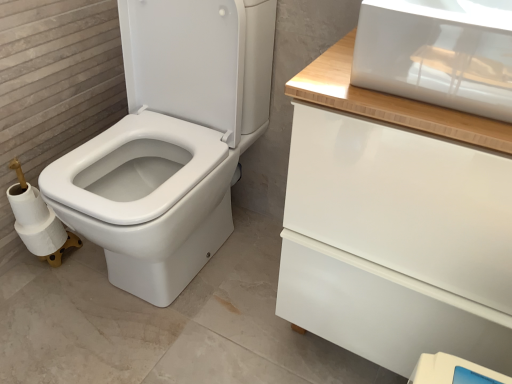
Question: Is white glossy drawer at upper right positioned in front of white matte toilet paper at lower left?

Choices:
 (A) yes
 (B) no

Answer: (A)

Question: Does white glossy drawer at upper right turn towards white matte toilet paper at lower left?

Choices:
 (A) yes
 (B) no

Answer: (B)

Question: Is white glossy drawer at upper right completely or partially outside of white matte toilet paper at lower left?

Choices:
 (A) yes
 (B) no

Answer: (A)

Question: Considering the relative positions of white glossy drawer at upper right and white matte toilet paper at lower left in the image provided, is white glossy drawer at upper right to the left of white matte toilet paper at lower left from the viewer's perspective?

Choices:
 (A) no
 (B) yes

Answer: (A)

Question: Considering the relative sizes of white glossy drawer at upper right and white matte toilet paper at lower left in the image provided, is white glossy drawer at upper right thinner than white matte toilet paper at lower left?

Choices:
 (A) yes
 (B) no

Answer: (B)

Question: Does white glossy drawer at upper right have a smaller size compared to white matte toilet paper at lower left?

Choices:
 (A) no
 (B) yes

Answer: (A)

Question: Considering the relative sizes of white matte toilet paper at lower left and white glossy drawer at upper right in the image provided, is white matte toilet paper at lower left shorter than white glossy drawer at upper right?

Choices:
 (A) no
 (B) yes

Answer: (B)

Question: From a real-world perspective, does white matte toilet paper at lower left stand above white glossy drawer at upper right?

Choices:
 (A) yes
 (B) no

Answer: (B)

Question: Is white matte toilet paper at lower left outside of white glossy drawer at upper right?

Choices:
 (A) no
 (B) yes

Answer: (B)

Question: Is white matte toilet paper at lower left positioned with its back to white glossy drawer at upper right?

Choices:
 (A) yes
 (B) no

Answer: (B)

Question: Considering the relative sizes of white matte toilet paper at lower left and white glossy drawer at upper right in the image provided, is white matte toilet paper at lower left taller than white glossy drawer at upper right?

Choices:
 (A) no
 (B) yes

Answer: (A)

Question: From a real-world perspective, is white matte toilet paper at lower left located beneath white glossy drawer at upper right?

Choices:
 (A) yes
 (B) no

Answer: (A)

Question: In the image, is white matte toilet paper at lower left positioned in front of or behind white glossy drawer at upper right?

Choices:
 (A) front
 (B) behind

Answer: (B)